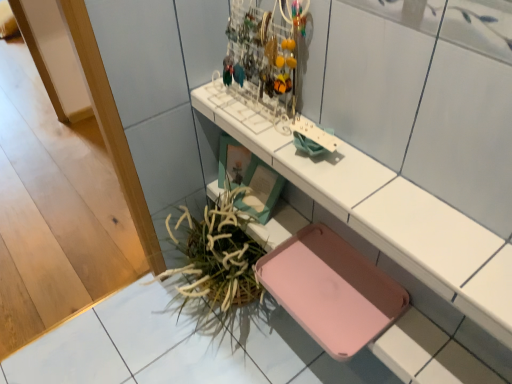
Question: Is green leafy plant at lower left at the back of pink plastic tray at upper center?

Choices:
 (A) no
 (B) yes

Answer: (A)

Question: Is pink plastic tray at upper center completely or partially outside of green leafy plant at lower left?

Choices:
 (A) yes
 (B) no

Answer: (A)

Question: From the image's perspective, would you say pink plastic tray at upper center is positioned over green leafy plant at lower left?

Choices:
 (A) yes
 (B) no

Answer: (A)

Question: Is the position of pink plastic tray at upper center more distant than that of green leafy plant at lower left?

Choices:
 (A) yes
 (B) no

Answer: (B)

Question: Can you confirm if pink plastic tray at upper center is positioned to the left of green leafy plant at lower left?

Choices:
 (A) no
 (B) yes

Answer: (A)

Question: Considering the relative sizes of pink plastic tray at upper center and green leafy plant at lower left in the image provided, is pink plastic tray at upper center bigger than green leafy plant at lower left?

Choices:
 (A) yes
 (B) no

Answer: (B)

Question: Is green leafy plant at lower left with pink plastic tray at upper center?

Choices:
 (A) no
 (B) yes

Answer: (A)

Question: Is green leafy plant at lower left further to camera compared to pink plastic tray at upper center?

Choices:
 (A) yes
 (B) no

Answer: (A)

Question: From a real-world perspective, is green leafy plant at lower left physically above pink plastic tray at upper center?

Choices:
 (A) no
 (B) yes

Answer: (A)

Question: Is green leafy plant at lower left bigger than pink plastic tray at upper center?

Choices:
 (A) no
 (B) yes

Answer: (B)

Question: Does green leafy plant at lower left have a smaller size compared to pink plastic tray at upper center?

Choices:
 (A) yes
 (B) no

Answer: (B)

Question: Can you confirm if green leafy plant at lower left is wider than pink plastic tray at upper center?

Choices:
 (A) no
 (B) yes

Answer: (B)

Question: From the image's perspective, is green leafy plant at lower left above or below pink plastic tray at upper center?

Choices:
 (A) below
 (B) above

Answer: (A)